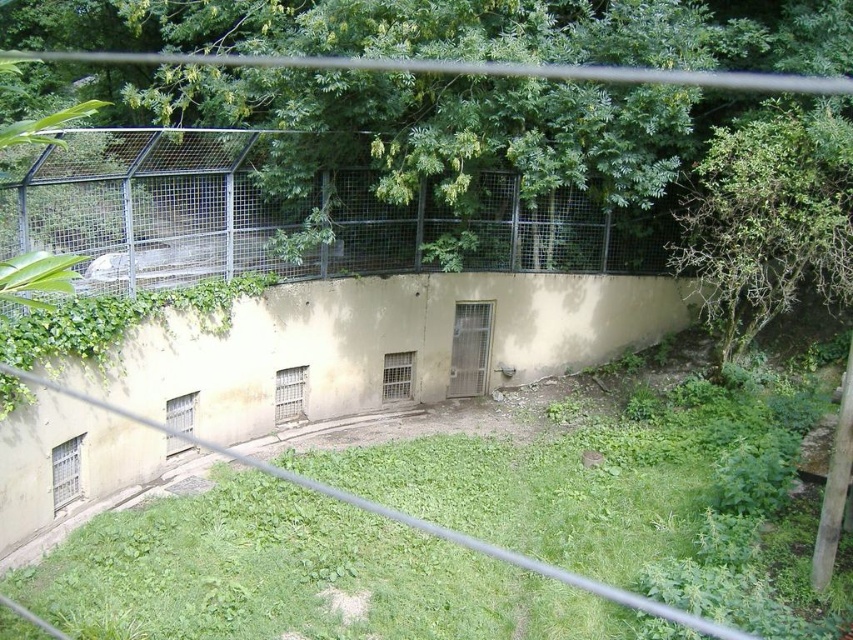
Does green leafy tree at upper right have a smaller size compared to green grass at lower center?

Yes.

Is green leafy tree at upper right closer to camera compared to green grass at lower center?

No, green leafy tree at upper right is further to the viewer.

In order to click on green leafy tree at upper right in this screenshot , I will do `click(766, 220)`.

Does metal mesh fence at upper center have a lesser height compared to green grass at lower center?

Correct, metal mesh fence at upper center is not as tall as green grass at lower center.

Is point (401, 257) more distant than point (115, 404)?

Yes, it is.

Is point (584, 230) positioned before point (49, 632)?

No, (584, 230) is behind (49, 632).

Identify the location of metal mesh fence at upper center. (193, 212).

Between metal mesh fence at upper center and green leafy tree at upper right, which one is positioned higher?

metal mesh fence at upper center is higher up.

Measure the distance from metal mesh fence at upper center to green leafy tree at upper right.

metal mesh fence at upper center and green leafy tree at upper right are 4.36 meters apart.

Where is `metal mesh fence at upper center`? metal mesh fence at upper center is located at coordinates (193, 212).

Find the location of a particular element. metal mesh fence at upper center is located at coordinates (193, 212).